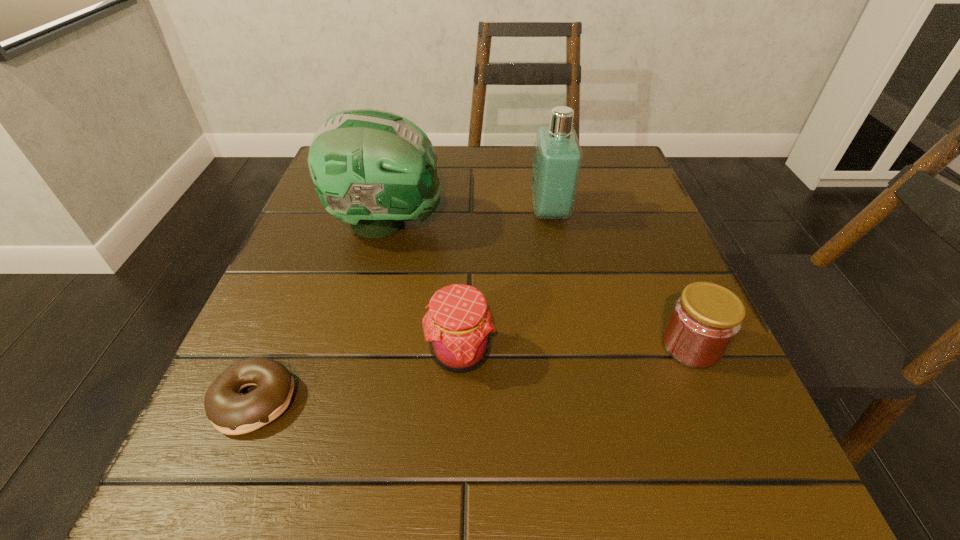
This screenshot has width=960, height=540. In order to click on vacant space that satisfies the following two spatial constraints: 1. on the visor of the football helmet; 2. on the back side of the right jam in this screenshot , I will do `click(356, 346)`.

At what (x,y) coordinates should I click in order to perform the action: click on vacant region that satisfies the following two spatial constraints: 1. on the front label of the rightmost object; 2. on the left side of the second object from right to left. Please return your answer as a coordinate pair (x, y). The width and height of the screenshot is (960, 540). Looking at the image, I should click on (575, 346).

Identify the location of free spot that satisfies the following two spatial constraints: 1. on the visor of the football helmet; 2. on the right side of the right jam. This screenshot has width=960, height=540. (356, 346).

This screenshot has width=960, height=540. I want to click on free space that satisfies the following two spatial constraints: 1. on the back side of the rightmost object; 2. on the right side of the left jam, so click(x=460, y=346).

The image size is (960, 540). I want to click on free space in the image that satisfies the following two spatial constraints: 1. on the back side of the right jam; 2. on the visor of the football helmet, so click(x=639, y=223).

Where is `free space that satisfies the following two spatial constraints: 1. on the visor of the football helmet; 2. on the left side of the rightmost object`? This screenshot has height=540, width=960. free space that satisfies the following two spatial constraints: 1. on the visor of the football helmet; 2. on the left side of the rightmost object is located at coordinates (356, 346).